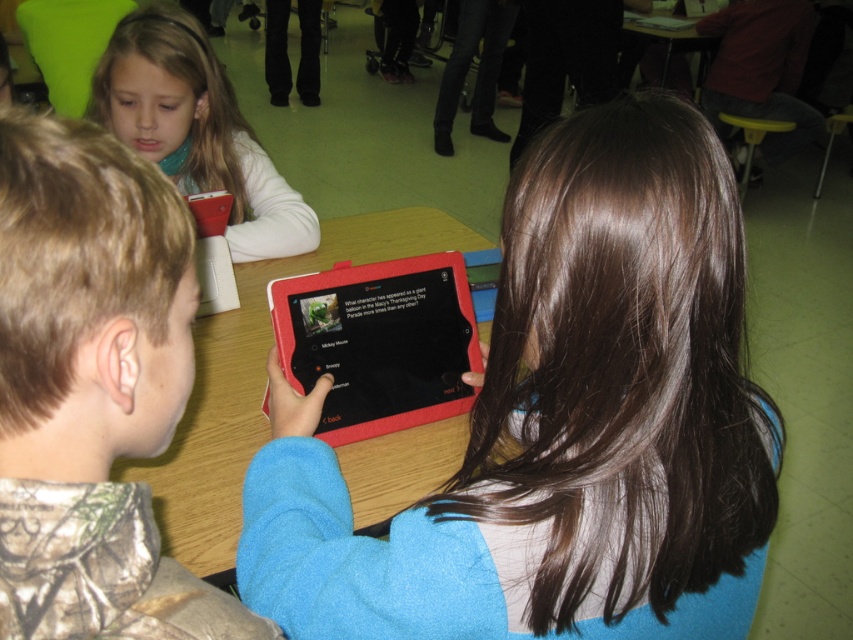
Question: Is camouflage fabric shirt at lower left below matte white phone at upper left?

Choices:
 (A) yes
 (B) no

Answer: (A)

Question: Which point is closer to the camera taking this photo?

Choices:
 (A) (508, 509)
 (B) (351, 397)
 (C) (144, 29)

Answer: (A)

Question: Which of the following is the closest to the observer?

Choices:
 (A) (115, 154)
 (B) (402, 632)
 (C) (370, 294)

Answer: (A)

Question: Can you confirm if rubberized black tablet at center is positioned to the right of matte white phone at upper left?

Choices:
 (A) yes
 (B) no

Answer: (A)

Question: Which of these objects is positioned farthest from the rubberized black tablet at center?

Choices:
 (A) matte white phone at upper left
 (B) wooden table at center

Answer: (A)

Question: Does camouflage fabric shirt at lower left come in front of rubberized black tablet at center?

Choices:
 (A) yes
 (B) no

Answer: (A)